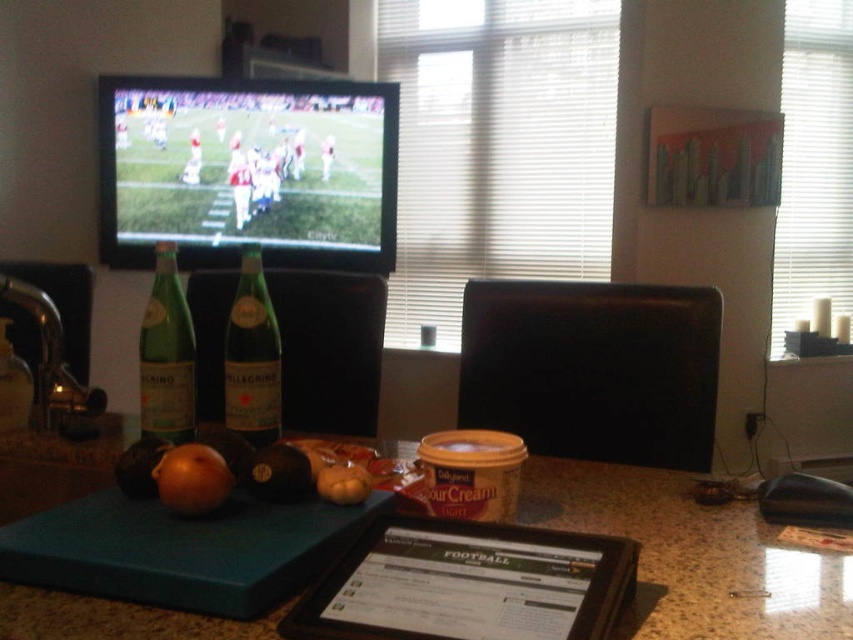
Question: Which of the following is the closest to the observer?

Choices:
 (A) green glass bottle at center
 (B) black plastic tablet at center

Answer: (B)

Question: Which point is farther from the camera taking this photo?

Choices:
 (A) (741, 624)
 (B) (189, 448)

Answer: (B)

Question: Is black plastic tablet at center below black matte onion at center?

Choices:
 (A) yes
 (B) no

Answer: (A)

Question: Can you confirm if granite countertop at center is positioned to the right of green glass bottle at left?

Choices:
 (A) no
 (B) yes

Answer: (B)

Question: Which object appears farthest from the camera in this image?

Choices:
 (A) granite countertop at center
 (B) black matte onion at center
 (C) green glass bottle at left

Answer: (C)

Question: Does green glass bottle at left appear on the left side of black matte onion at center?

Choices:
 (A) yes
 (B) no

Answer: (A)